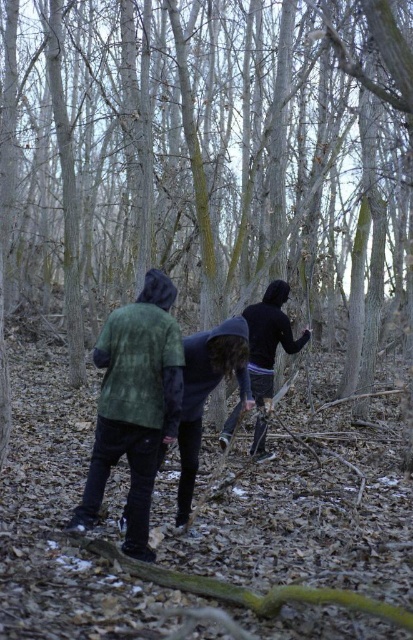
Question: Which of these objects is positioned closest to the green corduroy jacket at left?

Choices:
 (A) black matte jacket at center
 (B) smooth bark tree at center

Answer: (A)

Question: Does green corduroy jacket at left have a greater width compared to black matte jacket at center?

Choices:
 (A) yes
 (B) no

Answer: (A)

Question: Does green flannel shirt at center have a greater width compared to black matte jacket at center?

Choices:
 (A) no
 (B) yes

Answer: (B)

Question: Which object is the closest to the green corduroy jacket at left?

Choices:
 (A) black matte jacket at center
 (B) green flannel shirt at center
 (C) smooth bark tree at center

Answer: (B)

Question: Which of the following is the closest to the observer?

Choices:
 (A) (30, 58)
 (B) (144, 506)

Answer: (B)

Question: Is smooth bark tree at center above black matte jacket at center?

Choices:
 (A) yes
 (B) no

Answer: (A)